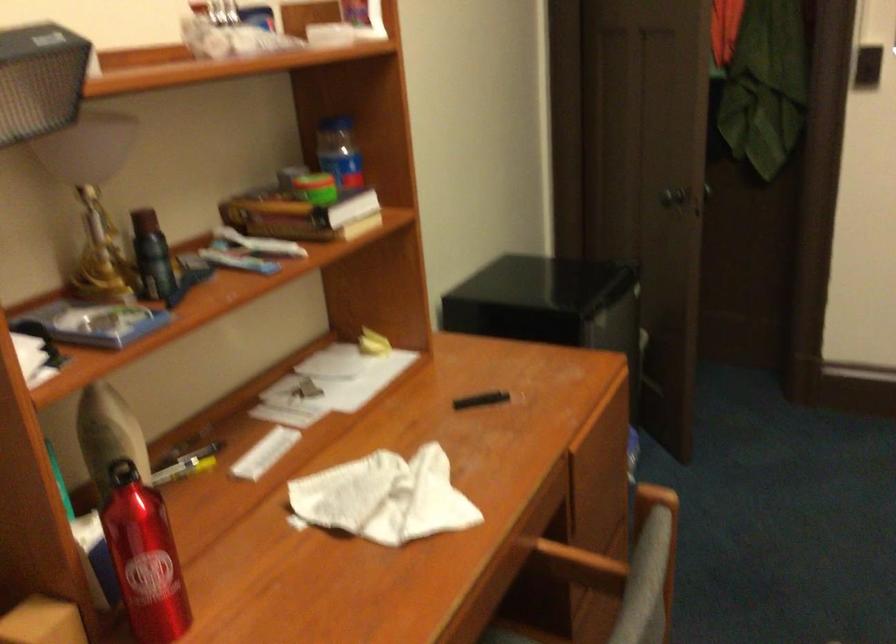
Find where to twist the blue jar lid. Please return your answer as a coordinate pair (x, y).

(339, 152)